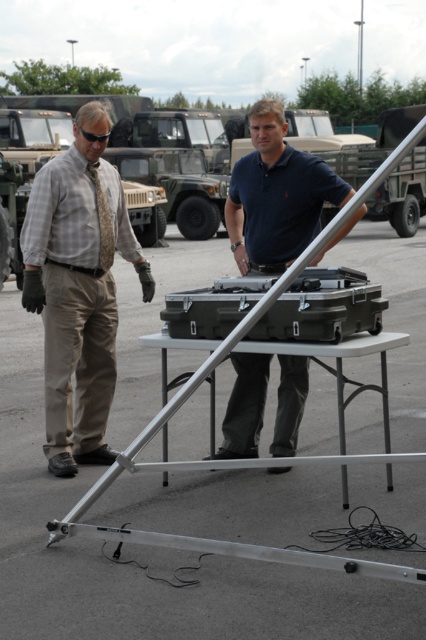
You are a photographer setting up equipment in the parking lot. You need to determine if your camera, which is the size of the matte black case at center, can fit under the tripod without overlapping the dark blue polo shirt at center. Can it?

The dark blue polo shirt at center is larger in size than the matte black case at center. Since the polo shirt is bigger, the camera might not fit under the tripod without overlapping it. Check the exact dimensions for confirmation.